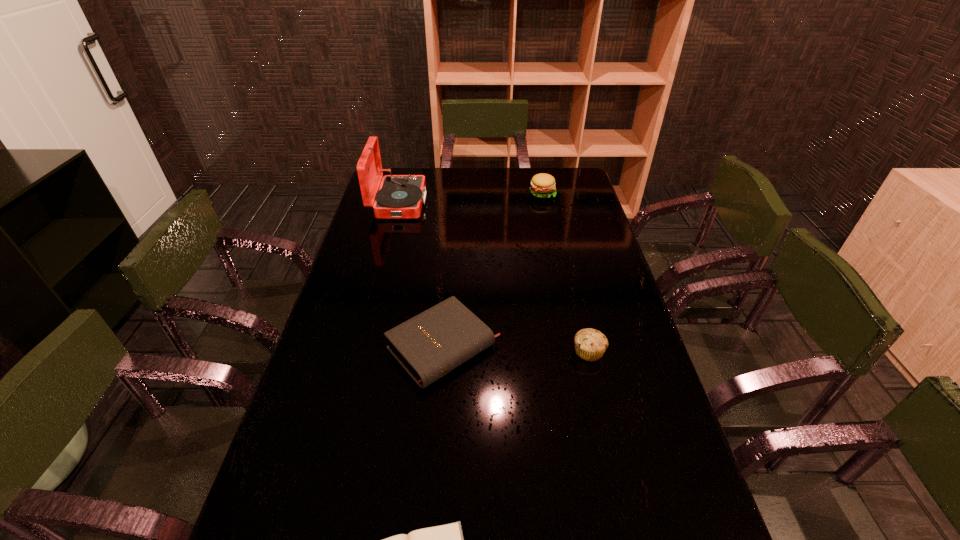
Locate an element on the screen. This screenshot has height=540, width=960. hamburger that is at the far edge is located at coordinates (543, 185).

In order to click on object that is at the left edge in this screenshot , I will do `click(400, 196)`.

Where is `hamburger situated at the right edge`? hamburger situated at the right edge is located at coordinates (543, 185).

Find the location of `muffin that is at the right edge`. muffin that is at the right edge is located at coordinates (590, 344).

Identify the location of object present at the far left corner. (400, 196).

Find the location of a particular element. The height and width of the screenshot is (540, 960). object located at the far right corner is located at coordinates (543, 185).

Where is `free space at the far edge of the desktop`? free space at the far edge of the desktop is located at coordinates (520, 173).

Where is `vacant region at the left edge of the desktop`? The image size is (960, 540). vacant region at the left edge of the desktop is located at coordinates (327, 313).

At what (x,y) coordinates should I click in order to perform the action: click on free spot at the right edge of the desktop. Please return your answer as a coordinate pair (x, y). This screenshot has width=960, height=540. Looking at the image, I should click on (587, 246).

In the image, there is a desktop. Where is `free region at the far right corner`? The width and height of the screenshot is (960, 540). free region at the far right corner is located at coordinates (569, 182).